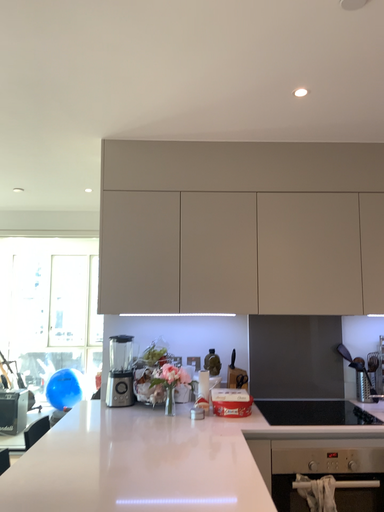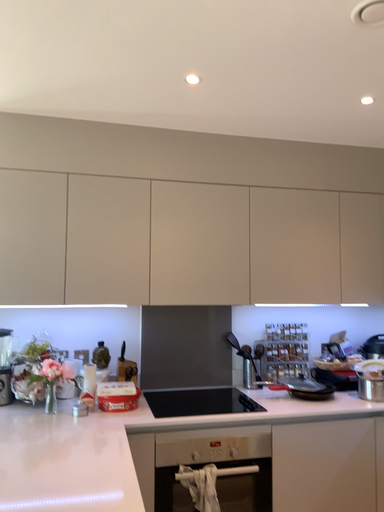
Question: How did the camera likely rotate when shooting the video?

Choices:
 (A) rotated right
 (B) rotated left

Answer: (A)